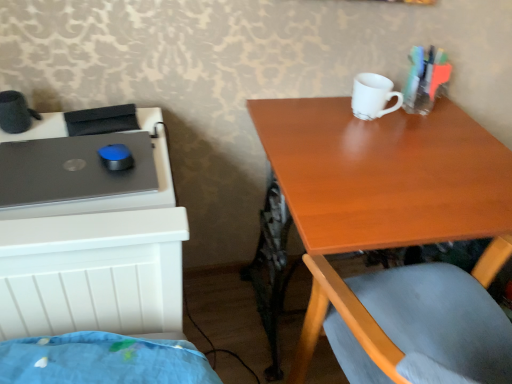
Question: From a real-world perspective, is matte black laptop at left on wooden table at upper right?

Choices:
 (A) yes
 (B) no

Answer: (A)

Question: Is matte black laptop at left placed right next to wooden table at upper right?

Choices:
 (A) no
 (B) yes

Answer: (A)

Question: Can you confirm if matte black laptop at left is thinner than wooden table at upper right?

Choices:
 (A) no
 (B) yes

Answer: (B)

Question: From the image's perspective, is matte black laptop at left on wooden table at upper right?

Choices:
 (A) yes
 (B) no

Answer: (A)

Question: From the image's perspective, is matte black laptop at left under wooden table at upper right?

Choices:
 (A) yes
 (B) no

Answer: (B)

Question: Is matte black laptop at left taller than wooden table at upper right?

Choices:
 (A) yes
 (B) no

Answer: (B)

Question: Considering the relative positions of white matte mug at upper center and matte black laptop at left in the image provided, is white matte mug at upper center to the left of matte black laptop at left from the viewer's perspective?

Choices:
 (A) no
 (B) yes

Answer: (A)

Question: Is white matte mug at upper center to the right of matte black laptop at left from the viewer's perspective?

Choices:
 (A) yes
 (B) no

Answer: (A)

Question: Is white matte mug at upper center facing towards matte black laptop at left?

Choices:
 (A) no
 (B) yes

Answer: (A)

Question: Is white matte mug at upper center smaller than matte black laptop at left?

Choices:
 (A) no
 (B) yes

Answer: (A)

Question: Does white matte mug at upper center have a lesser height compared to matte black laptop at left?

Choices:
 (A) yes
 (B) no

Answer: (B)

Question: Is white matte mug at upper center beside matte black laptop at left?

Choices:
 (A) no
 (B) yes

Answer: (A)

Question: Does matte black laptop at left appear on the right side of white matte mug at upper center?

Choices:
 (A) yes
 (B) no

Answer: (B)